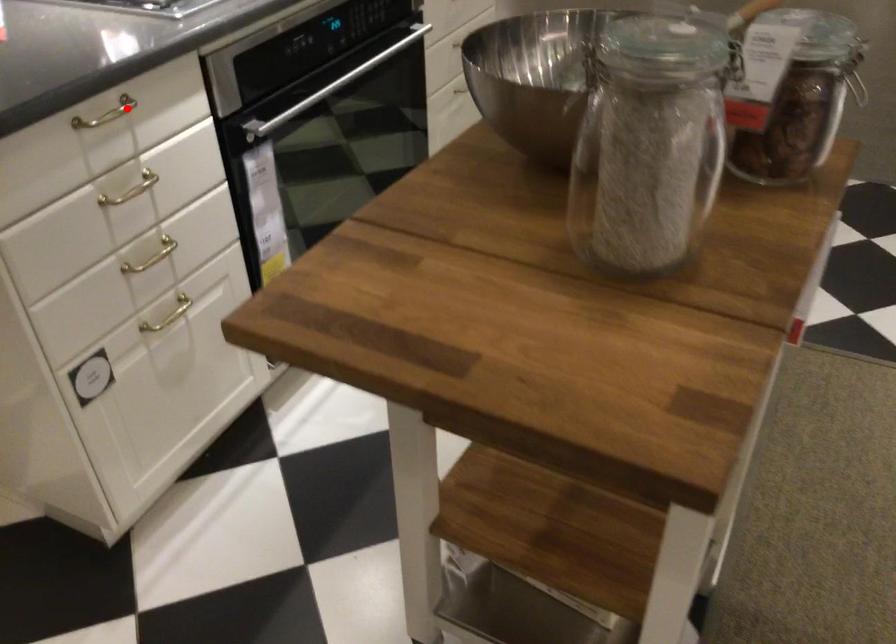
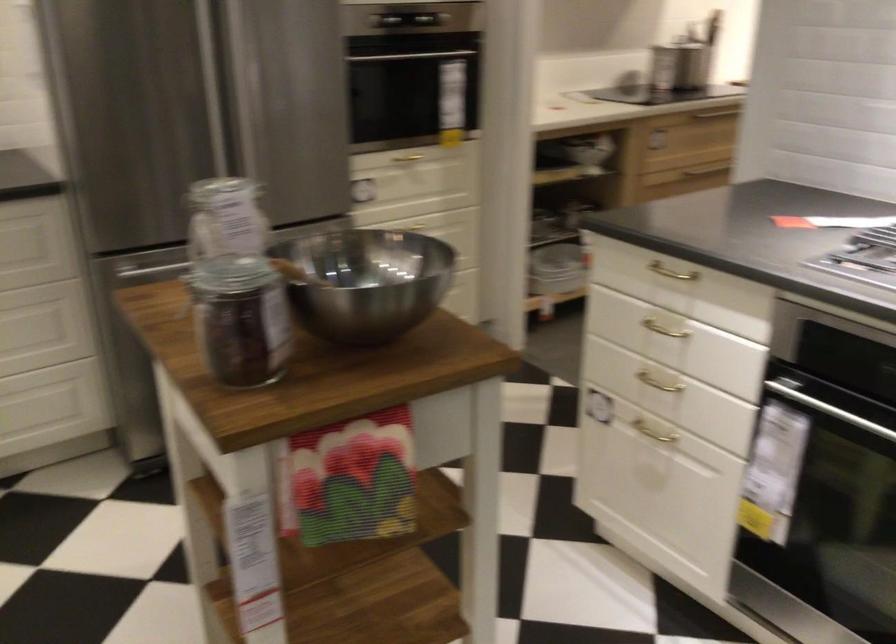
In the second image, find the point that corresponds to the highlighted location in the first image.

(670, 272)